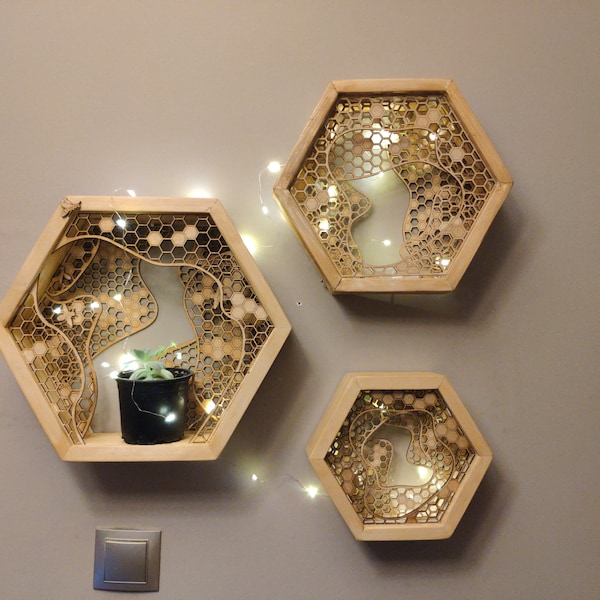
Image resolution: width=600 pixels, height=600 pixels. Find the location of `bucket`. bucket is located at coordinates (146, 421).